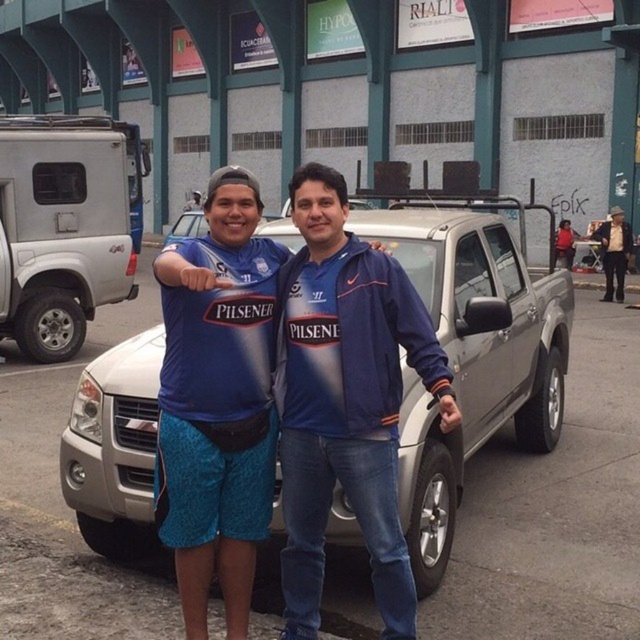
What do you see at coordinates (348, 86) in the screenshot? I see `brushed metal truck at center` at bounding box center [348, 86].

Who is lower down, brushed metal truck at center or silver metallic suv at left?

silver metallic suv at left is lower down.

Locate an element on the screen. brushed metal truck at center is located at coordinates (348, 86).

Which is behind, point (221, 60) or point (426, 291)?

The point (221, 60) is behind.

Is point (611, 164) farther from viewer compared to point (445, 348)?

Yes.

What are the coordinates of `brushed metal truck at center` in the screenshot? It's located at (348, 86).

The image size is (640, 640). In order to click on brushed metal truck at center in this screenshot , I will do `click(348, 86)`.

Between blue fabric jacket at center and silver metallic suv at left, which one has more height?

blue fabric jacket at center is taller.

Which is above, blue fabric jacket at center or silver metallic suv at left?

silver metallic suv at left is higher up.

Where is `blue fabric jacket at center`? blue fabric jacket at center is located at coordinates (346, 401).